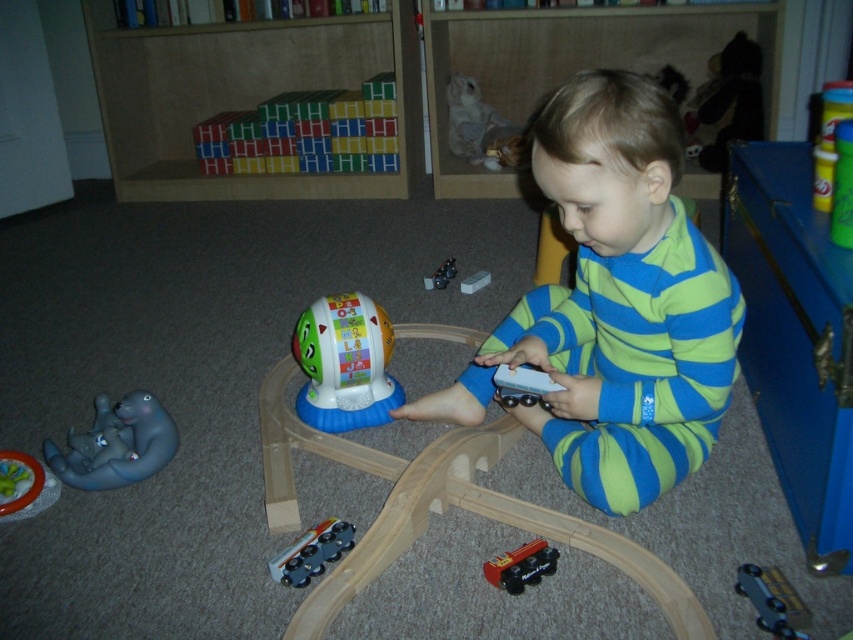
Who is more forward, (125,68) or (450,262)?

Point (450,262)

Can you confirm if wooden blocks at upper center is bigger than metallic silver train at center?

Indeed, wooden blocks at upper center has a larger size compared to metallic silver train at center.

The width and height of the screenshot is (853, 640). Identify the location of wooden blocks at upper center. (242, 97).

This screenshot has width=853, height=640. Describe the element at coordinates (521, 566) in the screenshot. I see `red plastic train at lower center` at that location.

Between red plastic train at lower center and white plastic train at center, which one has less height?

red plastic train at lower center is shorter.

Measure the distance between point (486, 576) and camera.

A distance of 4.17 feet exists between point (486, 576) and camera.

Identify the location of red plastic train at lower center. This screenshot has width=853, height=640. (521, 566).

Measure the distance from smooth plastic train at center to metallic silver train at center.

They are 89.54 centimeters apart.

Can you confirm if smooth plastic train at center is positioned below metallic silver train at center?

Yes, smooth plastic train at center is below metallic silver train at center.

Where is `smooth plastic train at center`? The width and height of the screenshot is (853, 640). smooth plastic train at center is located at coordinates (521, 385).